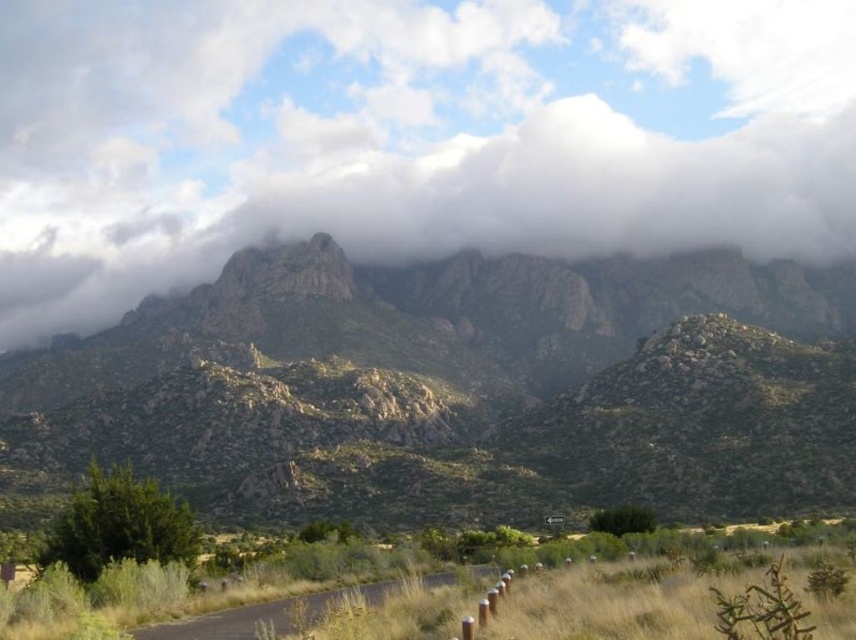
You are a hiker planning to take a photo of the rocky mountain range at upper center. You notice a white fluffy cloud at upper center in the scene. Will the cloud block the mountain when you take the photo?

The white fluffy cloud at upper center is much taller than the rocky mountain range at upper center, so the cloud will block the mountain in the photo.

You are standing at the starting point of the road and looking towards the mountains. There is a white fluffy cloud at upper center located at point (407, 136). Is the cloud above or below the mountains?

The white fluffy cloud at upper center is located at point (407, 136), which is above the mountains since it is in the sky area of the image.

Based on the photo, you are a photographer planning to capture the scenic view of the mountainous landscape. You want to position your camera such that the white fluffy cloud at upper center is centered in your shot. What coordinate should you aim for?

You should aim for the coordinate point at (407, 136) to center the white fluffy cloud at upper center in your shot.